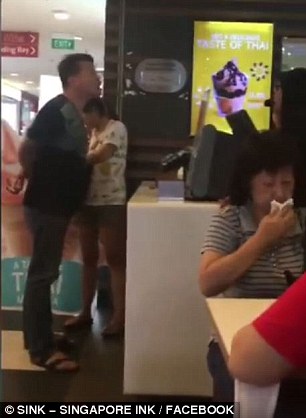
You are a GUI agent. You are given a task and a screenshot of the screen. Output one action in this format:
    pyautogui.click(x=<x>, y=<y>)
    Task: Click on the ceiling light
    This screenshot has width=306, height=418.
    Given the screenshot: What is the action you would take?
    pyautogui.click(x=58, y=13)